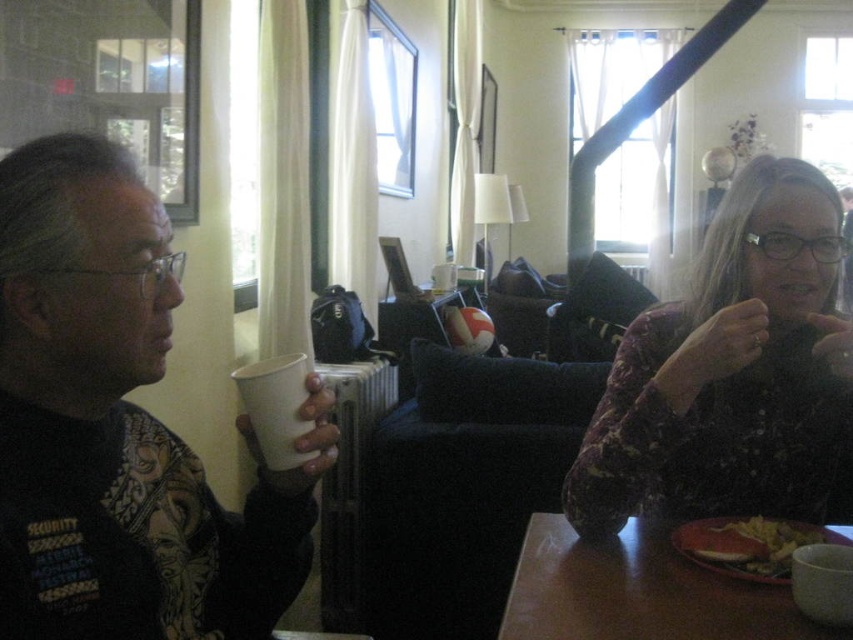
Who is shorter, white paper cup at left or brown wooden table at lower right?

Standing shorter between the two is brown wooden table at lower right.

Who is positioned more to the right, white paper cup at left or brown wooden table at lower right?

Positioned to the right is brown wooden table at lower right.

Who is more distant from viewer, (107,259) or (799,628)?

The point (799,628) is behind.

Locate an element on the screen. The image size is (853, 640). white paper cup at left is located at coordinates (119, 426).

Image resolution: width=853 pixels, height=640 pixels. Identify the location of matte purple sweater at right. (727, 371).

Who is more forward, (807, 397) or (643, 577)?

Point (643, 577) is more forward.

The image size is (853, 640). Identify the location of matte purple sweater at right. (727, 371).

Between matte purple sweater at right and matte plastic plate at lower right, which one appears on the right side from the viewer's perspective?

matte purple sweater at right

Is matte purple sweater at right closer to camera compared to matte plastic plate at lower right?

No, matte purple sweater at right is further to the viewer.

What do you see at coordinates (727, 371) in the screenshot? I see `matte purple sweater at right` at bounding box center [727, 371].

The height and width of the screenshot is (640, 853). Find the location of `matte purple sweater at right`. matte purple sweater at right is located at coordinates (727, 371).